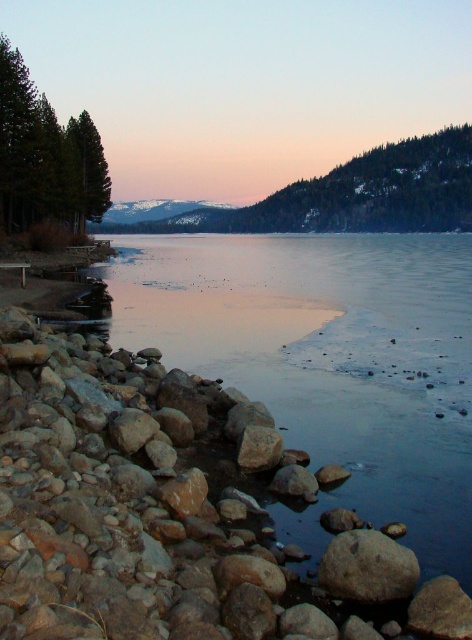
Find the location of a particular element. The width and height of the screenshot is (472, 640). brown rock at lower left is located at coordinates (169, 509).

Does brown rock at lower left have a lesser height compared to green textured tree at upper right?

Indeed, brown rock at lower left has a lesser height compared to green textured tree at upper right.

Where is `brown rock at lower left`? This screenshot has width=472, height=640. brown rock at lower left is located at coordinates (169, 509).

Between brown rock at lower left and green matte tree at left, which one has more height?

With more height is green matte tree at left.

Does brown rock at lower left appear over green matte tree at left?

No.

Where is `brown rock at lower left`? brown rock at lower left is located at coordinates (169, 509).

Is point (397, 189) positioned after point (212, 202)?

No, it is in front of (212, 202).

Where is `green textured tree at upper right`? green textured tree at upper right is located at coordinates (374, 192).